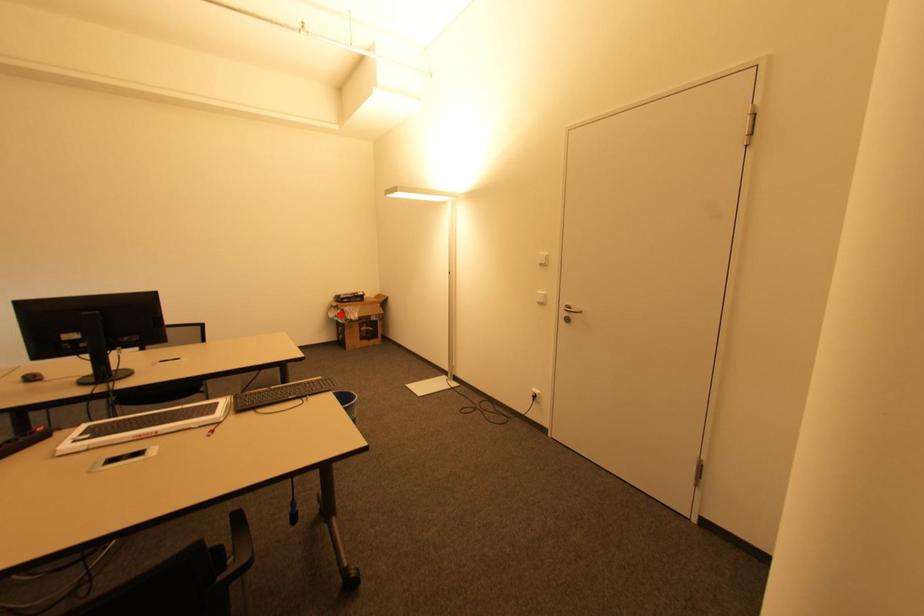
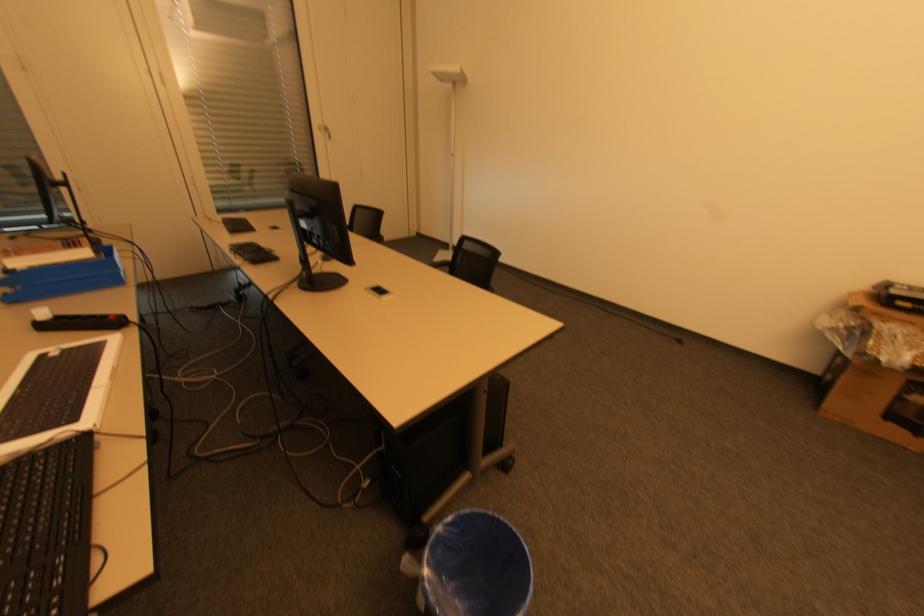
The point at the highlighted location is marked in the first image. Where is the corresponding point in the second image?

(850, 328)